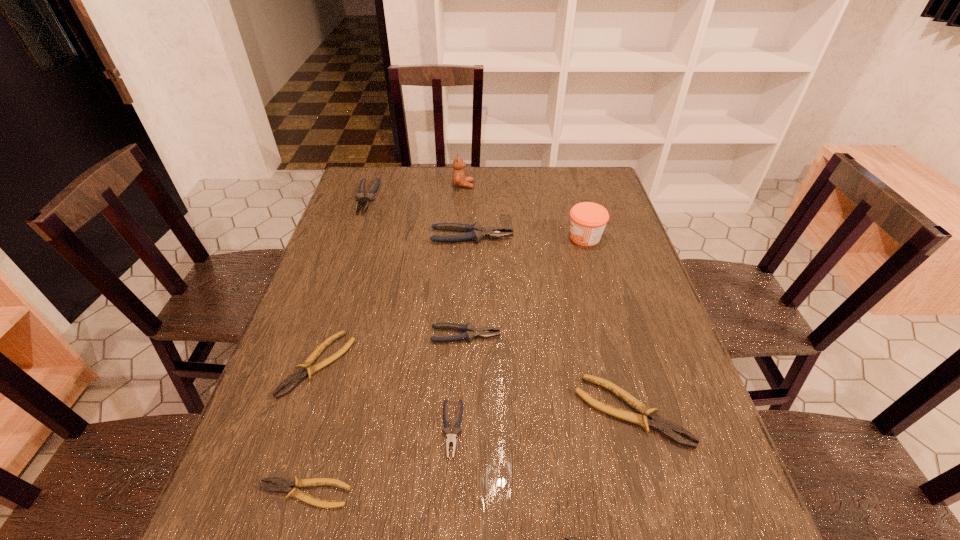
Identify the location of free space located 0.090m on the back of the biggest yellow pliers. The width and height of the screenshot is (960, 540). (612, 345).

Locate an element on the screen. This screenshot has height=540, width=960. vacant space situated 0.400m on the back of the third smallest yellow pliers is located at coordinates (360, 233).

Where is `vacant point located 0.110m at the gripping part of the nearest gray pliers`? This screenshot has height=540, width=960. vacant point located 0.110m at the gripping part of the nearest gray pliers is located at coordinates (447, 522).

This screenshot has width=960, height=540. What are the coordinates of `vacant space situated on the right of the second nearest object` in the screenshot? It's located at (378, 493).

This screenshot has width=960, height=540. Identify the location of teddy bear located at the far edge. (459, 180).

Find the location of `pliers situated at the far edge`. pliers situated at the far edge is located at coordinates (370, 195).

This screenshot has height=540, width=960. I want to click on jam present at the right edge, so click(588, 220).

Locate an element on the screen. This screenshot has height=540, width=960. pliers that is positioned at the right edge is located at coordinates (657, 423).

At what (x,y) coordinates should I click in order to perform the action: click on object present at the far left corner. Please return your answer as a coordinate pair (x, y). Looking at the image, I should click on (370, 195).

Locate an element on the screen. Image resolution: width=960 pixels, height=540 pixels. vacant area at the far edge is located at coordinates tap(516, 171).